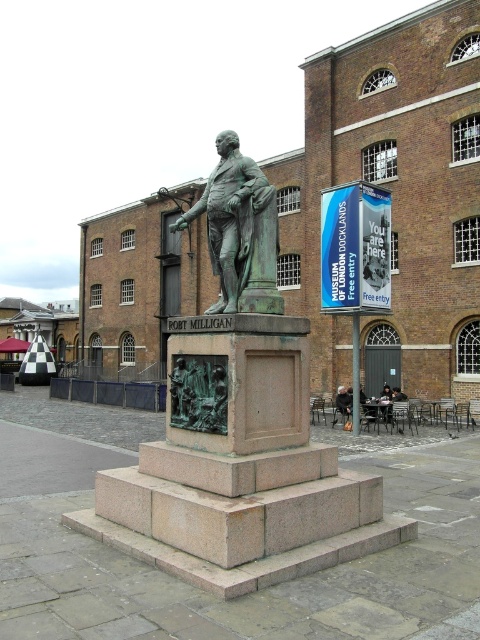
Question: Can you confirm if bronze statue at center is bigger than dark brown leather jacket at lower center?

Choices:
 (A) yes
 (B) no

Answer: (A)

Question: Can you confirm if bronze statue at center is positioned above dark brown leather jacket at lower center?

Choices:
 (A) no
 (B) yes

Answer: (B)

Question: Observing the image, what is the correct spatial positioning of bronze statue at center in reference to dark brown leather jacket at lower center?

Choices:
 (A) below
 (B) above

Answer: (B)